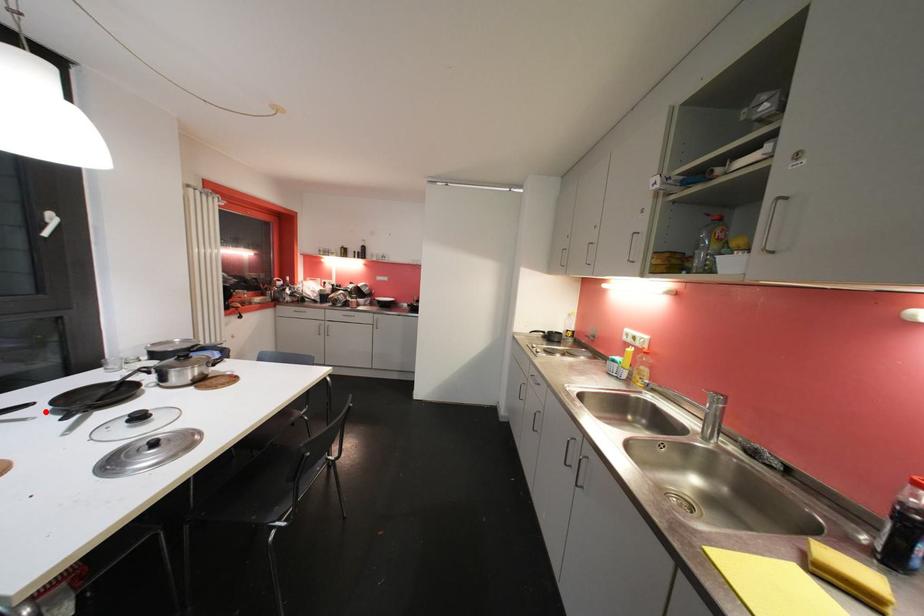
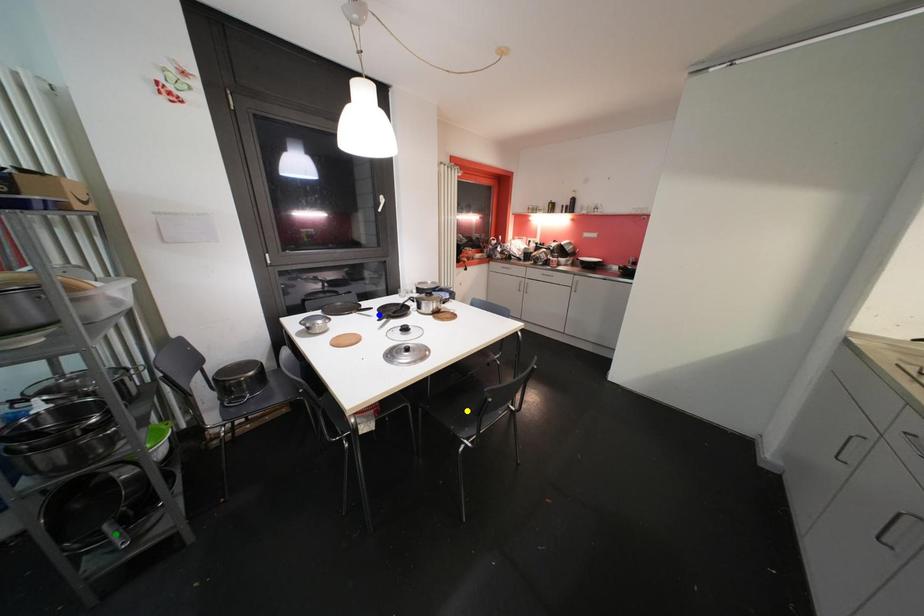
Question: I am providing you with two images of the same scene from different viewpoints. A red point is marked on the first image. You are given multiple points on the second image. In image 2, which mark is for the same physical point as the one in image 1?

Choices:
 (A) blue point
 (B) yellow point
 (C) green point

Answer: (A)